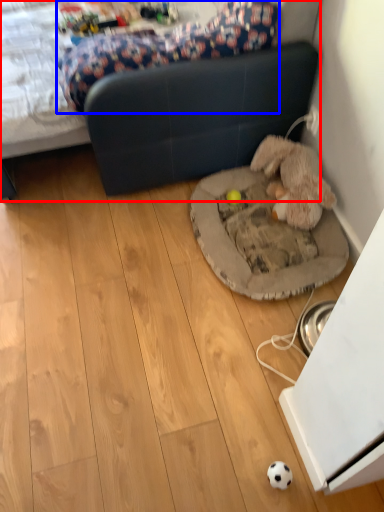
Question: Which of the following is the farthest to the observer, studio couch (highlighted by a red box) or mattress (highlighted by a blue box)?

Choices:
 (A) studio couch
 (B) mattress

Answer: (B)